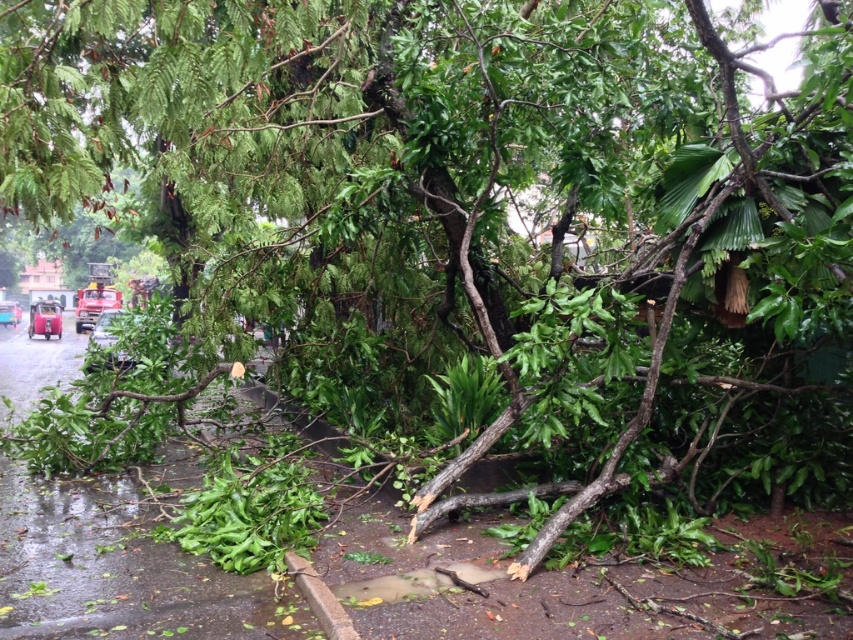
Question: Which object appears closest to the camera in this image?

Choices:
 (A) metallic blue car at lower left
 (B) metallic red car at left

Answer: (B)

Question: Which point appears closest to the camera in this image?

Choices:
 (A) (44, 330)
 (B) (1, 314)

Answer: (A)

Question: Can you confirm if metallic red car at left is positioned above metallic blue car at lower left?

Choices:
 (A) no
 (B) yes

Answer: (A)

Question: Is metallic red car at left above metallic blue car at lower left?

Choices:
 (A) no
 (B) yes

Answer: (A)

Question: Can you confirm if metallic red car at left is positioned to the right of metallic blue car at lower left?

Choices:
 (A) no
 (B) yes

Answer: (B)